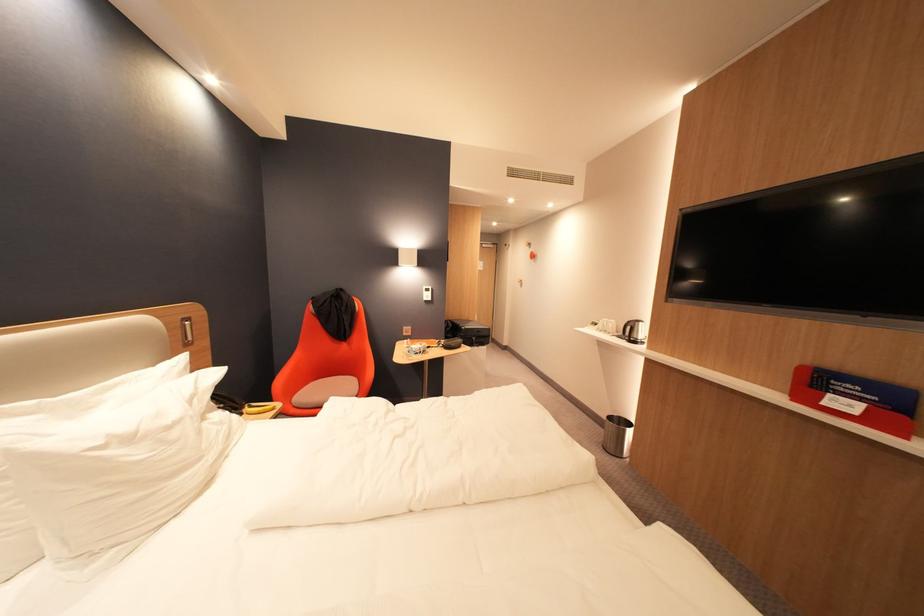
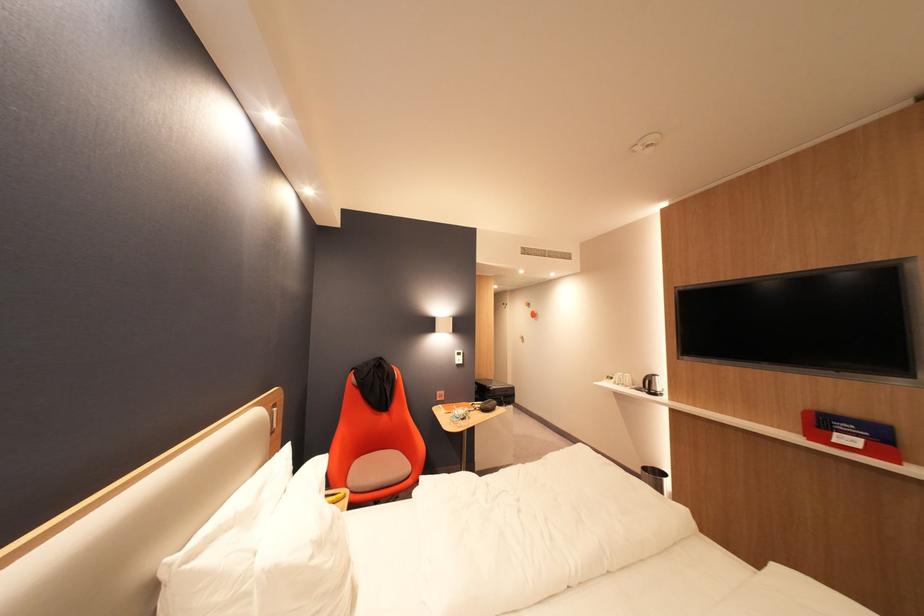
Locate, in the second image, the point that corresponds to pixel 302 403 in the first image.

(359, 488)